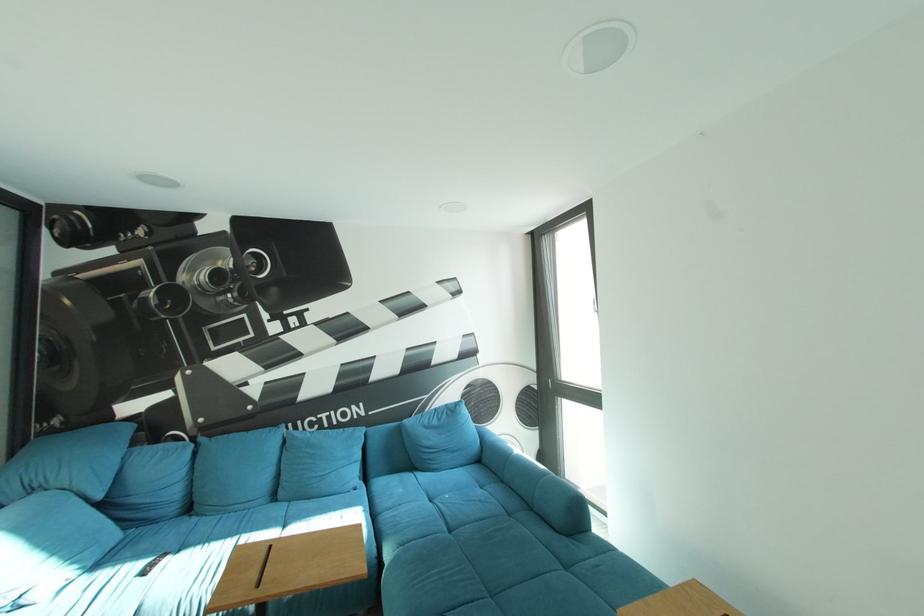
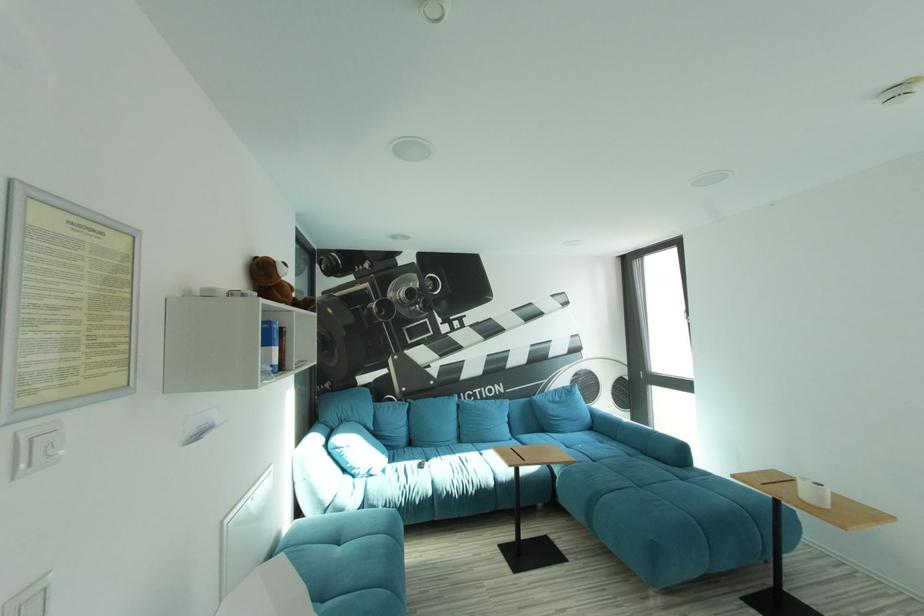
The images are taken continuously from a first-person perspective. In which direction are you moving?

The movement direction of the cameraman is left, backward.